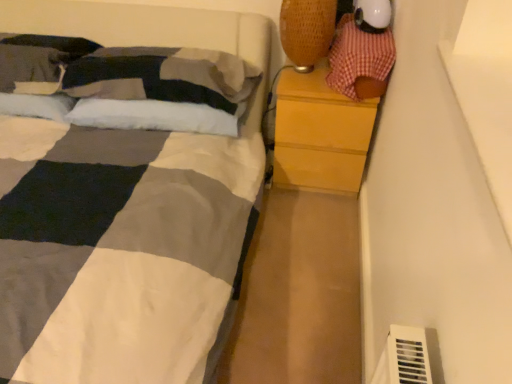
The height and width of the screenshot is (384, 512). In order to click on free space in front of wooden chest of drawers at right in this screenshot , I will do `click(307, 224)`.